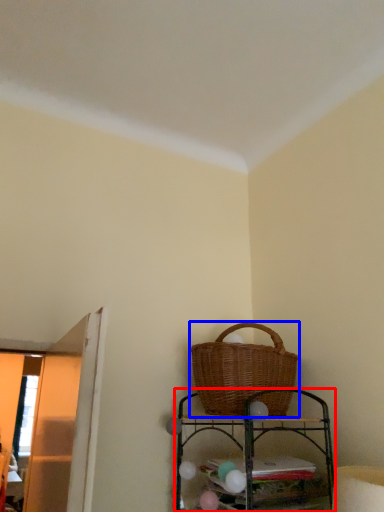
Question: Which point is further to the camera, shelf (highlighted by a red box) or picnic basket (highlighted by a blue box)?

Choices:
 (A) shelf
 (B) picnic basket

Answer: (B)